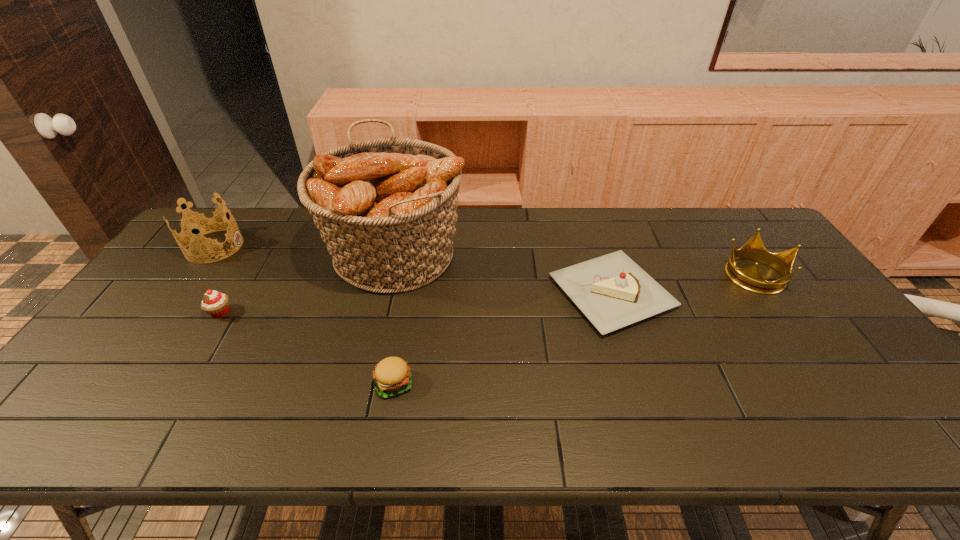
This screenshot has height=540, width=960. In order to click on free area in between the basket and the cupcake in this screenshot , I will do `click(308, 282)`.

You are a GUI agent. You are given a task and a screenshot of the screen. Output one action in this format:
    pyautogui.click(x=<x>, y=<y>)
    Task: Click on the free space between the tallest object and the second object from right to left
    
    Given the screenshot: What is the action you would take?
    pyautogui.click(x=503, y=273)

Image resolution: width=960 pixels, height=540 pixels. What are the coordinates of `free area in between the shorter crown and the second object from left to right` in the screenshot? It's located at (488, 293).

Where is `object identified as the closest to the rightmost object`? This screenshot has width=960, height=540. object identified as the closest to the rightmost object is located at coordinates (612, 291).

At what (x,y) coordinates should I click in order to perform the action: click on the fifth closest object to the cake. Please return your answer as a coordinate pair (x, y). This screenshot has height=540, width=960. Looking at the image, I should click on (203, 225).

Identify the location of free space in the image that satisfies the following two spatial constraints: 1. on the back side of the rightmost object; 2. on the right side of the nearest object. The width and height of the screenshot is (960, 540). (412, 274).

Locate an element on the screen. Image resolution: width=960 pixels, height=540 pixels. free point that satisfies the following two spatial constraints: 1. on the front side of the taller crown; 2. on the right side of the cake is located at coordinates (180, 293).

Identify the location of free location that satisfies the following two spatial constraints: 1. on the back side of the shorter crown; 2. on the left side of the fifth object from right to left. The width and height of the screenshot is (960, 540). (243, 274).